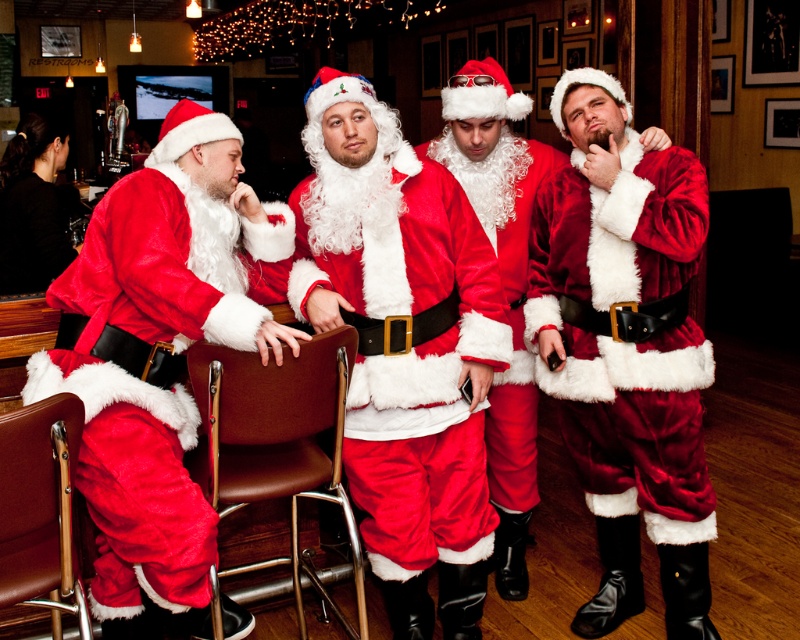
Which is more to the right, fuzzy red santa suit at center or velvet santa suit at center?

velvet santa suit at center

Which is in front, point (336, 248) or point (468, 109)?

Point (336, 248) is more forward.

Locate an element on the screen. fuzzy red santa suit at center is located at coordinates (404, 348).

Find the location of a particular element. fuzzy red santa suit at center is located at coordinates (404, 348).

Does point (384, 592) come behind point (630, 333)?

Yes, it is.

Between fuzzy red santa suit at center and velvet santa claus at right, which one is positioned higher?

fuzzy red santa suit at center

Find the location of a particular element. fuzzy red santa suit at center is located at coordinates (404, 348).

Can you confirm if fuzzy red santa suit at left is positioned to the right of velvet santa claus at right?

No, fuzzy red santa suit at left is not to the right of velvet santa claus at right.

Which of these two, fuzzy red santa suit at left or velvet santa claus at right, stands shorter?

fuzzy red santa suit at left

Measure the distance between point (242, 205) and camera.

They are 7.01 feet apart.

Locate an element on the screen. fuzzy red santa suit at left is located at coordinates (162, 356).